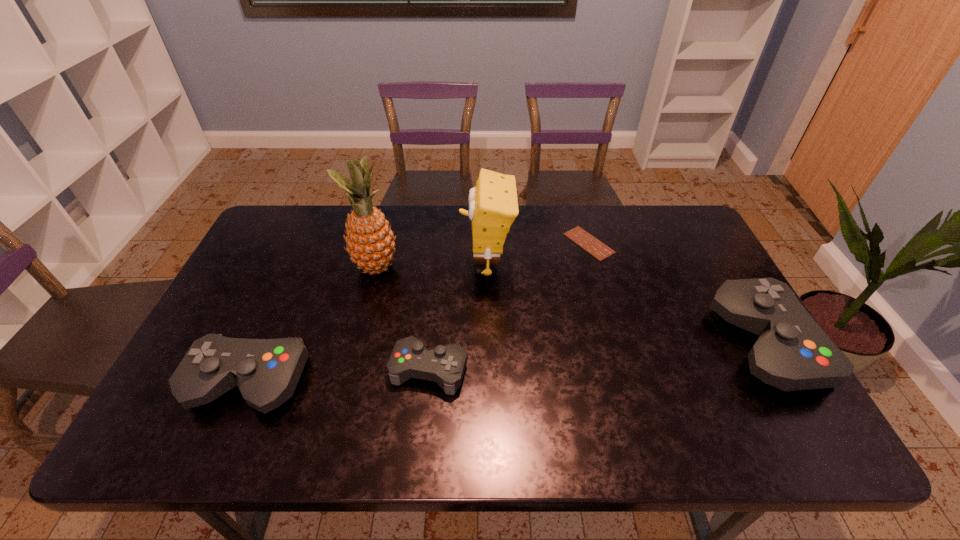
Identify the location of the second shortest control. The image size is (960, 540). (266, 371).

This screenshot has height=540, width=960. I want to click on the leftmost object, so click(266, 371).

Image resolution: width=960 pixels, height=540 pixels. What are the coordinates of `the fifth tallest object` in the screenshot? It's located at (445, 364).

Locate an element on the screen. This screenshot has width=960, height=540. the shortest control is located at coordinates 445,364.

Locate an element on the screen. The width and height of the screenshot is (960, 540). the rightmost control is located at coordinates (792, 353).

This screenshot has width=960, height=540. Find the location of `the fifth shortest object`. the fifth shortest object is located at coordinates (493, 205).

Where is `the shortest object`? The image size is (960, 540). the shortest object is located at coordinates (589, 243).

Locate an element on the screen. Image resolution: width=960 pixels, height=540 pixels. chocolate bar is located at coordinates [589, 243].

You are a GUI agent. You are given a task and a screenshot of the screen. Output one action in this format:
    pyautogui.click(x=<x>, y=<y>)
    Task: Click on the second object from left to right
    This screenshot has width=960, height=540.
    Given the screenshot: What is the action you would take?
    pyautogui.click(x=370, y=242)

The width and height of the screenshot is (960, 540). In order to click on the tallest object in this screenshot , I will do `click(370, 242)`.